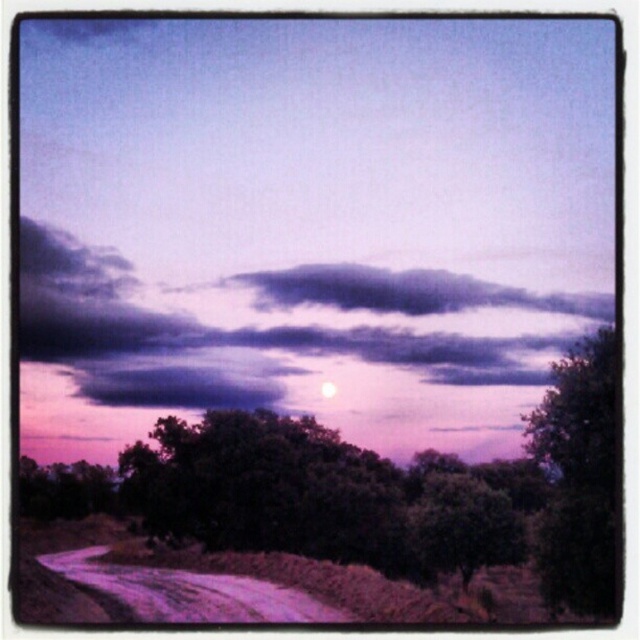
You are standing at the point labeled point (88, 376) and want to walk to the point labeled point (380, 618). Which direction should you move to get closer to your destination?

You should move towards the direction away from the viewer because point (380, 618) is closer to the viewer than point (88, 376). Moving away from the viewer would take you towards the destination.

You are driving along the dirt road and see the dark green leafy tree at right and the white glossy moon at center. Which object is positioned farther to the east if the sun is setting?

The dark green leafy tree at right is positioned farther to the east because during sunset, the sun is in the west. Since the dark green leafy tree at right is to the right of the white glossy moon at center, and assuming the road curves towards the east, the tree would be further east than the moon.